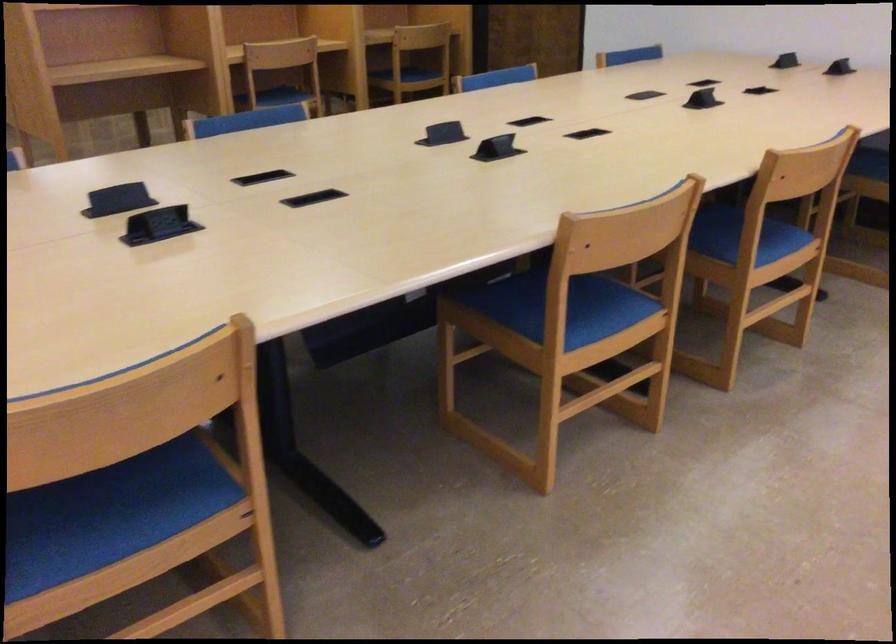
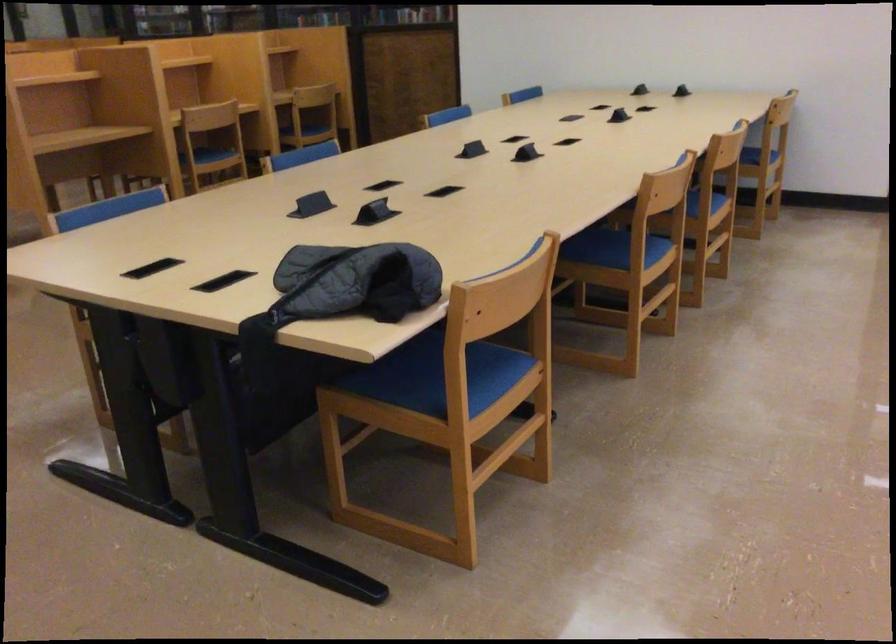
In the second image, find the point that corresponds to [547,324] in the first image.

(624, 254)